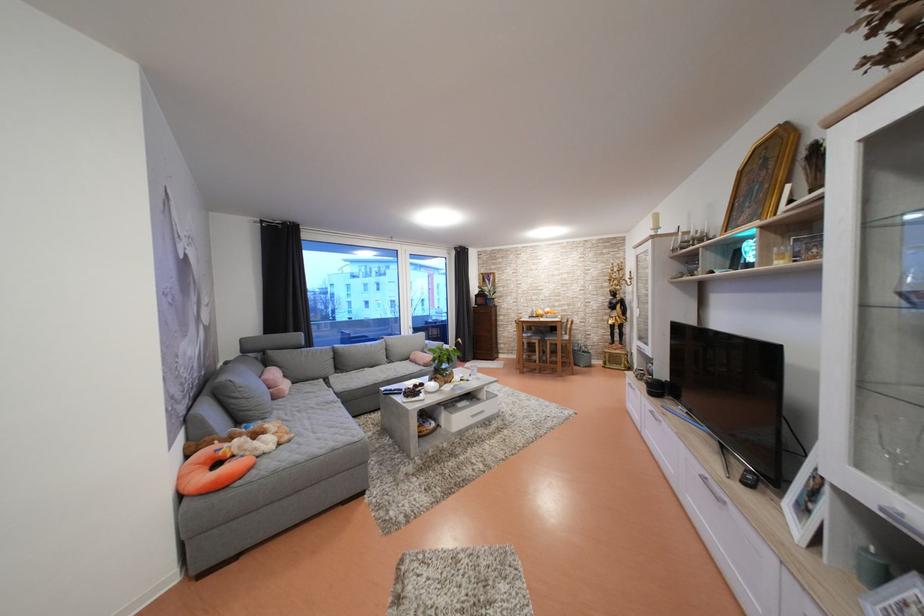
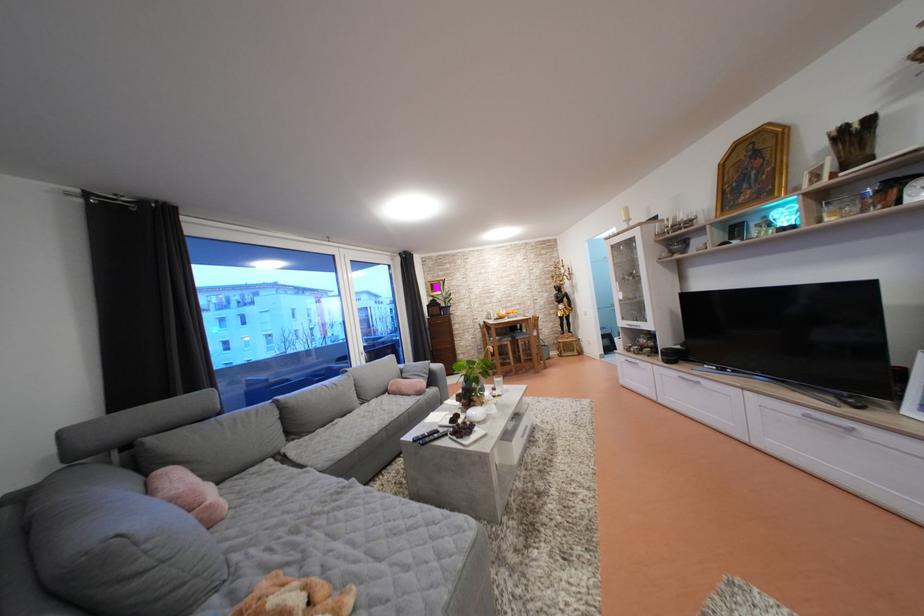
Locate, in the second image, the point that corresponds to the point at 272,386 in the first image.

(180, 505)